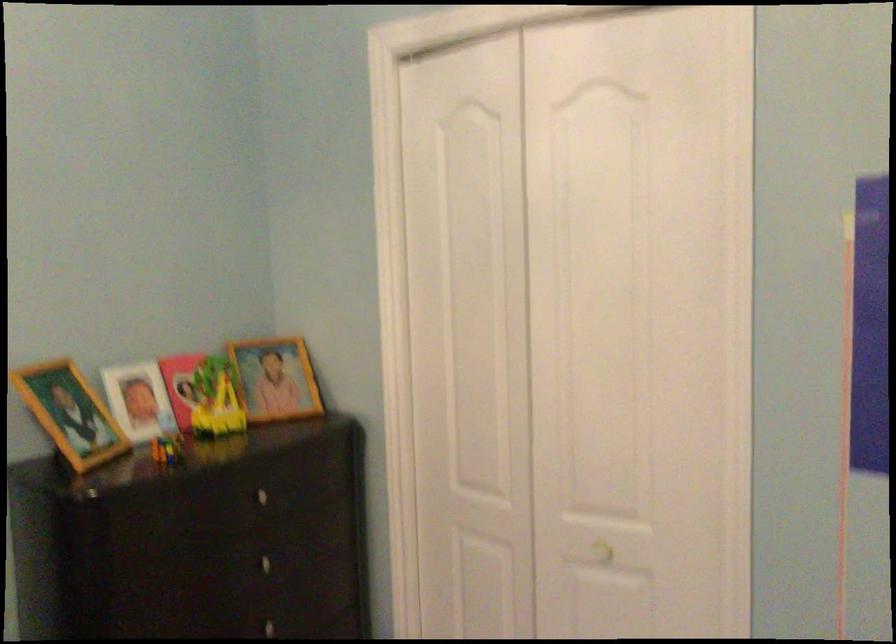
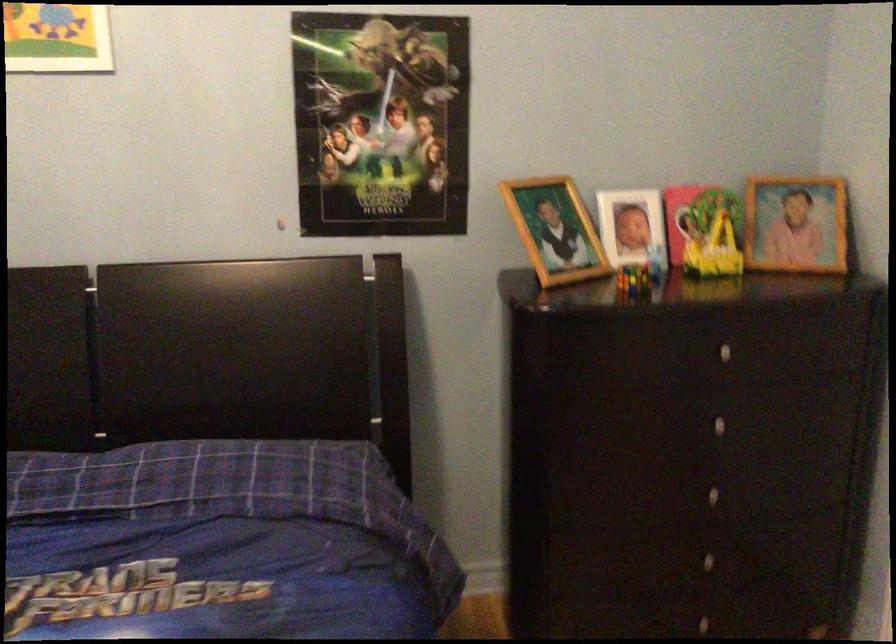
Where in the second image is the point corresponding to (70,413) from the first image?

(555, 230)